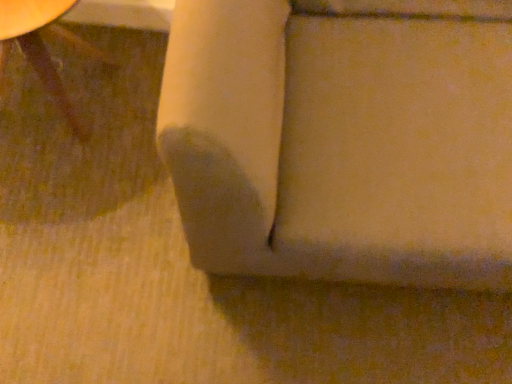
The height and width of the screenshot is (384, 512). Find the location of `matte beige cushion at center, positioned as the first furniture in right-to-left order`. matte beige cushion at center, positioned as the first furniture in right-to-left order is located at coordinates (343, 138).

The width and height of the screenshot is (512, 384). Describe the element at coordinates (343, 138) in the screenshot. I see `matte beige cushion at center, the second furniture in the left-to-right sequence` at that location.

This screenshot has width=512, height=384. What are the coordinates of `matte brown wood table at lower left, placed as the 1th furniture when sorted from left to right` in the screenshot? It's located at (44, 48).

In order to face matte brown wood table at lower left, placed as the 1th furniture when sorted from left to right, should I rotate leftwards or rightwards?

A 27.686 degree turn to the left will do.

What do you see at coordinates (44, 48) in the screenshot? I see `matte brown wood table at lower left, placed as the second furniture when sorted from right to left` at bounding box center [44, 48].

Image resolution: width=512 pixels, height=384 pixels. What are the coordinates of `matte beige cushion at center, the second furniture in the left-to-right sequence` in the screenshot? It's located at (343, 138).

Considering the positions of objects matte brown wood table at lower left, placed as the 1th furniture when sorted from left to right, and matte beige cushion at center, positioned as the first furniture in right-to-left order, in the image provided, who is more to the right, matte brown wood table at lower left, placed as the 1th furniture when sorted from left to right, or matte beige cushion at center, positioned as the first furniture in right-to-left order,?

matte beige cushion at center, positioned as the first furniture in right-to-left order, is more to the right.

Considering the relative positions of matte brown wood table at lower left, placed as the 1th furniture when sorted from left to right, and matte beige cushion at center, the second furniture in the left-to-right sequence, in the image provided, is matte brown wood table at lower left, placed as the 1th furniture when sorted from left to right, behind matte beige cushion at center, the second furniture in the left-to-right sequence,?

Yes, it is behind matte beige cushion at center, the second furniture in the left-to-right sequence.

Which is more distant, (1, 25) or (280, 64)?

The point (1, 25) is farther from the camera.

Consider the image. From the image's perspective, is matte brown wood table at lower left, placed as the 1th furniture when sorted from left to right, below matte beige cushion at center, the second furniture in the left-to-right sequence?

No.

From a real-world perspective, is matte brown wood table at lower left, placed as the 1th furniture when sorted from left to right, located higher than matte beige cushion at center, positioned as the first furniture in right-to-left order?

Actually, matte brown wood table at lower left, placed as the 1th furniture when sorted from left to right, is physically below matte beige cushion at center, positioned as the first furniture in right-to-left order, in the real world.

Considering the sizes of matte brown wood table at lower left, placed as the second furniture when sorted from right to left, and matte beige cushion at center, positioned as the first furniture in right-to-left order, in the image, is matte brown wood table at lower left, placed as the second furniture when sorted from right to left, wider or thinner than matte beige cushion at center, positioned as the first furniture in right-to-left order,?

Considering their sizes, matte brown wood table at lower left, placed as the second furniture when sorted from right to left, looks slimmer than matte beige cushion at center, positioned as the first furniture in right-to-left order.

Which of these two, matte brown wood table at lower left, placed as the second furniture when sorted from right to left, or matte beige cushion at center, the second furniture in the left-to-right sequence, stands taller?

Standing taller between the two is matte beige cushion at center, the second furniture in the left-to-right sequence.

Considering the sizes of matte brown wood table at lower left, placed as the 1th furniture when sorted from left to right, and matte beige cushion at center, the second furniture in the left-to-right sequence, in the image, is matte brown wood table at lower left, placed as the 1th furniture when sorted from left to right, bigger or smaller than matte beige cushion at center, the second furniture in the left-to-right sequence,?

Clearly, matte brown wood table at lower left, placed as the 1th furniture when sorted from left to right, is smaller in size than matte beige cushion at center, the second furniture in the left-to-right sequence.

Is matte beige cushion at center, the second furniture in the left-to-right sequence, completely or partially inside matte brown wood table at lower left, placed as the 1th furniture when sorted from left to right?

That's incorrect, matte beige cushion at center, the second furniture in the left-to-right sequence, is not inside matte brown wood table at lower left, placed as the 1th furniture when sorted from left to right.

Is matte brown wood table at lower left, placed as the 1th furniture when sorted from left to right, next to matte beige cushion at center, positioned as the first furniture in right-to-left order, and touching it?

No, matte brown wood table at lower left, placed as the 1th furniture when sorted from left to right, is not touching matte beige cushion at center, positioned as the first furniture in right-to-left order.

Is matte brown wood table at lower left, placed as the second furniture when sorted from right to left, oriented away from matte beige cushion at center, positioned as the first furniture in right-to-left order?

No, matte brown wood table at lower left, placed as the second furniture when sorted from right to left, is not facing the opposite direction of matte beige cushion at center, positioned as the first furniture in right-to-left order.

Can you tell me how much matte brown wood table at lower left, placed as the 1th furniture when sorted from left to right, and matte beige cushion at center, positioned as the first furniture in right-to-left order, differ in facing direction?

There is a 1.46-degree angle between the facing directions of matte brown wood table at lower left, placed as the 1th furniture when sorted from left to right, and matte beige cushion at center, positioned as the first furniture in right-to-left order.

Based on the photo, could you measure the distance between matte brown wood table at lower left, placed as the second furniture when sorted from right to left, and matte beige cushion at center, the second furniture in the left-to-right sequence?

They are 92.34 centimeters apart.

Locate an element on the screen. The image size is (512, 384). furniture behind the matte beige cushion at center, positioned as the first furniture in right-to-left order is located at coordinates (44, 48).

Considering the positions of objects matte beige cushion at center, the second furniture in the left-to-right sequence, and matte brown wood table at lower left, placed as the second furniture when sorted from right to left, in the image provided, who is more to the left, matte beige cushion at center, the second furniture in the left-to-right sequence, or matte brown wood table at lower left, placed as the second furniture when sorted from right to left,?

Positioned to the left is matte brown wood table at lower left, placed as the second furniture when sorted from right to left.

Is matte beige cushion at center, the second furniture in the left-to-right sequence, closer to the viewer compared to matte brown wood table at lower left, placed as the 1th furniture when sorted from left to right?

Yes.

Does point (318, 66) come behind point (55, 32)?

No, (318, 66) is closer to viewer.

From the image's perspective, is matte beige cushion at center, positioned as the first furniture in right-to-left order, located beneath matte brown wood table at lower left, placed as the second furniture when sorted from right to left?

Yes, from the image's perspective, matte beige cushion at center, positioned as the first furniture in right-to-left order, is beneath matte brown wood table at lower left, placed as the second furniture when sorted from right to left.

From a real-world perspective, which is physically above, matte beige cushion at center, positioned as the first furniture in right-to-left order, or matte brown wood table at lower left, placed as the 1th furniture when sorted from left to right?

matte beige cushion at center, positioned as the first furniture in right-to-left order.

Is matte beige cushion at center, positioned as the first furniture in right-to-left order, thinner than matte brown wood table at lower left, placed as the second furniture when sorted from right to left?

In fact, matte beige cushion at center, positioned as the first furniture in right-to-left order, might be wider than matte brown wood table at lower left, placed as the second furniture when sorted from right to left.

Who is shorter, matte beige cushion at center, positioned as the first furniture in right-to-left order, or matte brown wood table at lower left, placed as the 1th furniture when sorted from left to right?

matte brown wood table at lower left, placed as the 1th furniture when sorted from left to right.

Considering the relative sizes of matte beige cushion at center, positioned as the first furniture in right-to-left order, and matte brown wood table at lower left, placed as the 1th furniture when sorted from left to right, in the image provided, is matte beige cushion at center, positioned as the first furniture in right-to-left order, smaller than matte brown wood table at lower left, placed as the 1th furniture when sorted from left to right,?

Actually, matte beige cushion at center, positioned as the first furniture in right-to-left order, might be larger than matte brown wood table at lower left, placed as the 1th furniture when sorted from left to right.

Is matte brown wood table at lower left, placed as the second furniture when sorted from right to left, a part of matte beige cushion at center, positioned as the first furniture in right-to-left order?

No.

Is matte beige cushion at center, the second furniture in the left-to-right sequence, not close to matte brown wood table at lower left, placed as the second furniture when sorted from right to left?

matte beige cushion at center, the second furniture in the left-to-right sequence, is actually quite close to matte brown wood table at lower left, placed as the second furniture when sorted from right to left.

Could you tell me if matte beige cushion at center, the second furniture in the left-to-right sequence, is turned towards matte brown wood table at lower left, placed as the 1th furniture when sorted from left to right?

No, matte beige cushion at center, the second furniture in the left-to-right sequence, is not facing towards matte brown wood table at lower left, placed as the 1th furniture when sorted from left to right.

Identify the location of furniture above the matte brown wood table at lower left, placed as the second furniture when sorted from right to left (from a real-world perspective). (343, 138).

In the image, there is a matte beige cushion at center, positioned as the first furniture in right-to-left order. Identify the location of furniture above it (from the image's perspective). The width and height of the screenshot is (512, 384). (44, 48).

Locate an element on the screen. The image size is (512, 384). furniture that is in front of the matte brown wood table at lower left, placed as the 1th furniture when sorted from left to right is located at coordinates tap(343, 138).